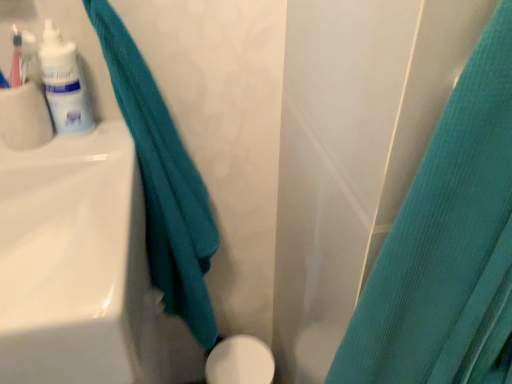
Question: Is teal fabric towel at left, the 1th curtain positioned from the left, further to camera compared to teal fabric curtain at right, which is the first curtain from right to left?

Choices:
 (A) no
 (B) yes

Answer: (B)

Question: Is teal fabric towel at left, the 1th curtain positioned from the left, positioned beyond the bounds of teal fabric curtain at right, which is the first curtain from right to left?

Choices:
 (A) no
 (B) yes

Answer: (B)

Question: From the image's perspective, would you say teal fabric towel at left, the second curtain in the right-to-left sequence, is shown under teal fabric curtain at right, which is the 2th curtain from left to right?

Choices:
 (A) no
 (B) yes

Answer: (A)

Question: Can you confirm if teal fabric towel at left, the second curtain in the right-to-left sequence, is taller than teal fabric curtain at right, which is the first curtain from right to left?

Choices:
 (A) yes
 (B) no

Answer: (A)

Question: Does teal fabric towel at left, the second curtain in the right-to-left sequence, have a smaller size compared to teal fabric curtain at right, which is the 2th curtain from left to right?

Choices:
 (A) yes
 (B) no

Answer: (A)

Question: Is there a large distance between teal fabric towel at left, the 1th curtain positioned from the left, and teal fabric curtain at right, which is the 2th curtain from left to right?

Choices:
 (A) no
 (B) yes

Answer: (A)

Question: From the image's perspective, does white glossy lotion at upper left appear lower than white glossy porcelain at lower center?

Choices:
 (A) yes
 (B) no

Answer: (B)

Question: From a real-world perspective, is white glossy lotion at upper left physically above white glossy porcelain at lower center?

Choices:
 (A) no
 (B) yes

Answer: (B)

Question: Can you confirm if white glossy lotion at upper left is wider than white glossy porcelain at lower center?

Choices:
 (A) yes
 (B) no

Answer: (B)

Question: From a real-world perspective, is white glossy lotion at upper left located beneath white glossy porcelain at lower center?

Choices:
 (A) no
 (B) yes

Answer: (A)

Question: Would you say white glossy porcelain at lower center is part of white glossy lotion at upper left's contents?

Choices:
 (A) yes
 (B) no

Answer: (B)

Question: Is white glossy lotion at upper left to the left of white glossy porcelain at lower center from the viewer's perspective?

Choices:
 (A) no
 (B) yes

Answer: (B)

Question: Does white glossy porcelain at lower center appear on the right side of teal fabric curtain at right, which is the 2th curtain from left to right?

Choices:
 (A) yes
 (B) no

Answer: (B)